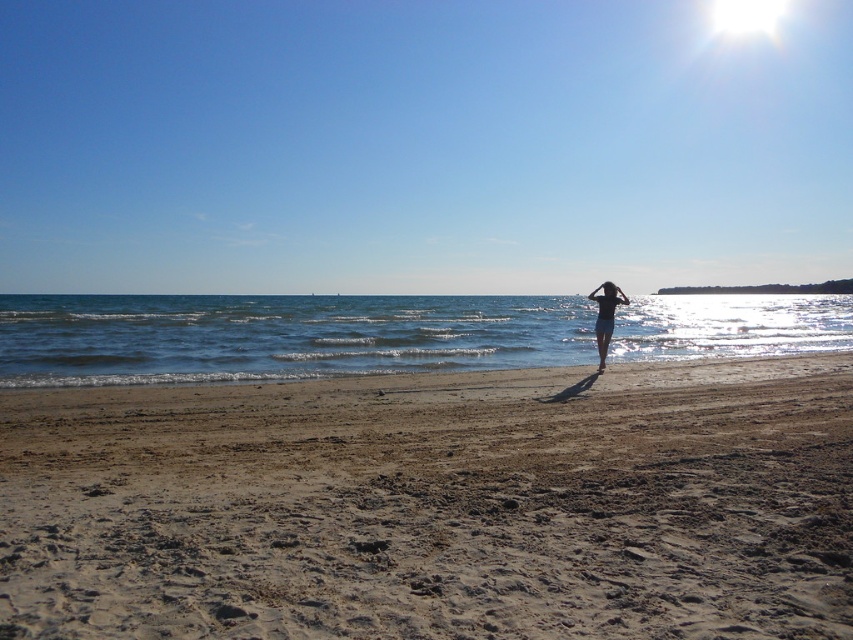
You are a photographer at the beach and want to capture a shot of both the blue water at center and the blue fabric swimsuit at center. Which object should you position on the left side of your frame to ensure both are visible?

The blue water at center is to the left of the blue fabric swimsuit at center, so you should position the blue water at center on the left side of your frame to ensure both are visible.

You are a photographer trying to capture a clear shot of the blue fabric swimsuit at center without the blue water at center overwhelming the image. Based on their sizes, which object should you focus on to ensure the swimsuit is the main subject?

The blue water at center is larger in size than the blue fabric swimsuit at center. To ensure the swimsuit is the main subject, focus on the smaller blue fabric swimsuit at center.